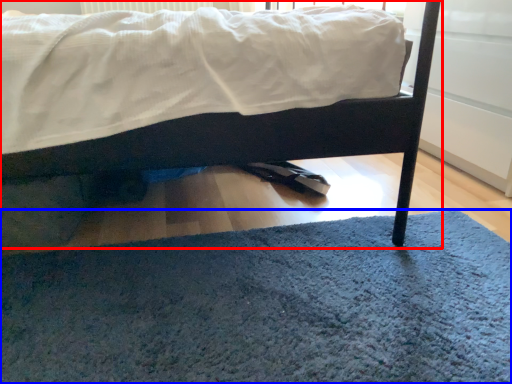
Question: Among these objects, which one is farthest to the camera, bed (highlighted by a red box) or doormat (highlighted by a blue box)?

Choices:
 (A) bed
 (B) doormat

Answer: (A)